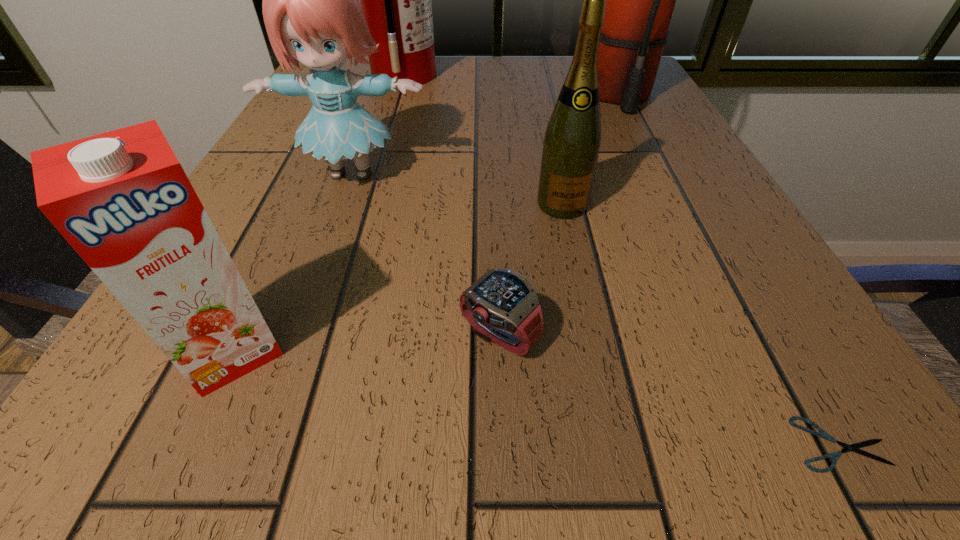
Where is `carton located at the left edge`? Image resolution: width=960 pixels, height=540 pixels. carton located at the left edge is located at coordinates (122, 200).

The height and width of the screenshot is (540, 960). I want to click on fire extinguisher located in the right edge section of the desktop, so click(x=640, y=0).

The height and width of the screenshot is (540, 960). In order to click on shears situated at the right edge in this screenshot , I will do `click(834, 456)`.

Where is `object present at the far left corner`? object present at the far left corner is located at coordinates (395, 0).

Locate an element on the screen. The width and height of the screenshot is (960, 540). object present at the near left corner is located at coordinates [122, 200].

Locate an element on the screen. object that is at the far right corner is located at coordinates (640, 0).

Locate an element on the screen. object present at the near right corner is located at coordinates (834, 456).

Image resolution: width=960 pixels, height=540 pixels. What are the coordinates of `vacant space at the far edge` in the screenshot? It's located at (477, 56).

Image resolution: width=960 pixels, height=540 pixels. In order to click on vacant position at the left edge of the desktop in this screenshot , I will do `click(238, 208)`.

You are a GUI agent. You are given a task and a screenshot of the screen. Output one action in this format:
    pyautogui.click(x=<x>, y=<y>)
    Task: Click on the free space at the right edge of the desktop
    
    Given the screenshot: What is the action you would take?
    pyautogui.click(x=684, y=144)